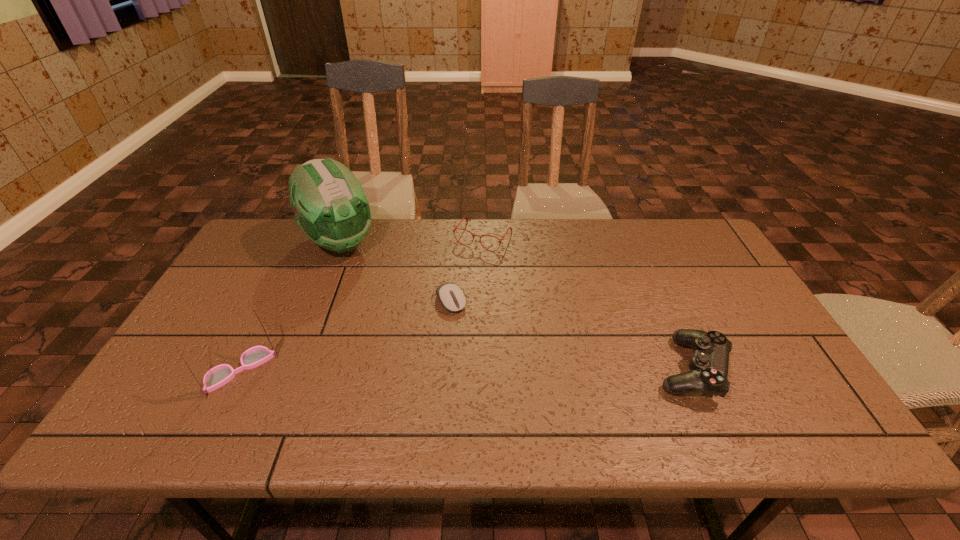
You are a GUI agent. You are given a task and a screenshot of the screen. Output one action in this format:
    pyautogui.click(x=<x>, y=<y>)
    Task: Click on the free space located on the left of the rightmost object
    The width and height of the screenshot is (960, 540).
    Given the screenshot: What is the action you would take?
    pyautogui.click(x=533, y=369)

Locate an element on the screen. The width and height of the screenshot is (960, 540). vacant space located 0.100m on the wheel side of the third farthest object is located at coordinates (474, 339).

I want to click on free space located on the wheel side of the third farthest object, so click(x=472, y=336).

Image resolution: width=960 pixels, height=540 pixels. What are the coordinates of `vacant space located 0.090m on the wheel side of the third farthest object` in the screenshot? It's located at (472, 336).

Identify the location of vacant space situated on the visor of the tallest object. The height and width of the screenshot is (540, 960). (376, 291).

At what (x,y) coordinates should I click in order to perform the action: click on vacant region located 0.200m on the visor of the tallest object. Please return your answer as a coordinate pair (x, y). Looking at the image, I should click on (384, 300).

Locate an element on the screen. This screenshot has height=540, width=960. free space located on the visor of the tallest object is located at coordinates (366, 278).

The width and height of the screenshot is (960, 540). Find the location of `free location located on the face of the shorter spectacles`. free location located on the face of the shorter spectacles is located at coordinates (462, 269).

You are a GUI agent. You are given a task and a screenshot of the screen. Output one action in this format:
    pyautogui.click(x=<x>, y=<y>)
    Task: Click on the vacant space positioned on the face of the shorter spectacles
    Image resolution: width=960 pixels, height=540 pixels.
    Given the screenshot: What is the action you would take?
    pyautogui.click(x=442, y=302)

The height and width of the screenshot is (540, 960). In order to click on vacant area situated on the face of the shorter spectacles in this screenshot , I will do `click(462, 269)`.